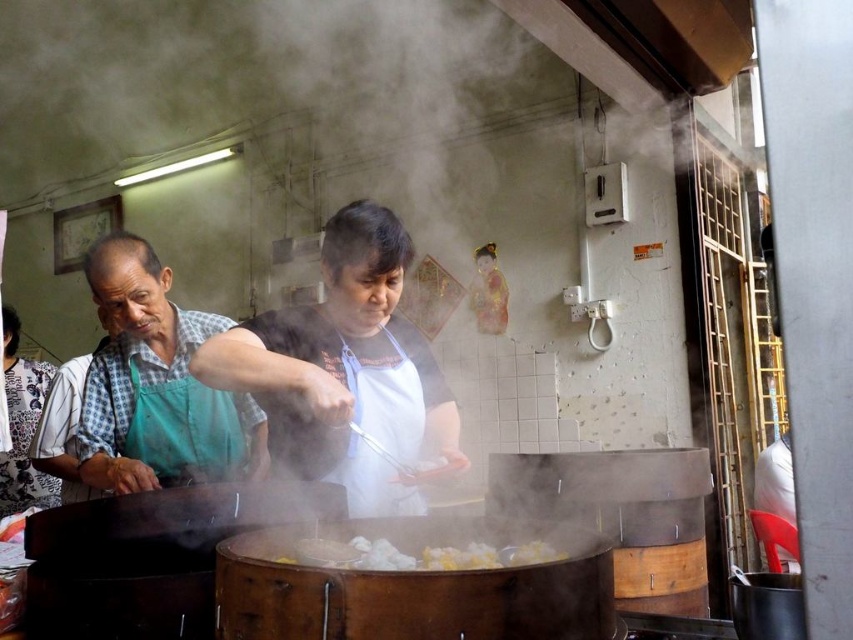
You are a customer at the food stall and want to take a photo of the white fluffy dumplings at center. However, the white apron at center is blocking your view. Can you see the dumplings clearly through the apron?

The white apron at center is located above the white fluffy dumplings at center, so the apron is blocking the view of the dumplings. You cannot see the dumplings clearly through the apron.

You are a customer waiting in line at the food stall. You see the green apron at left and the white fluffy dumplings at center. Which object is closer to you?

The green apron at left is closer to you because it is further to the viewer than the white fluffy dumplings at center.